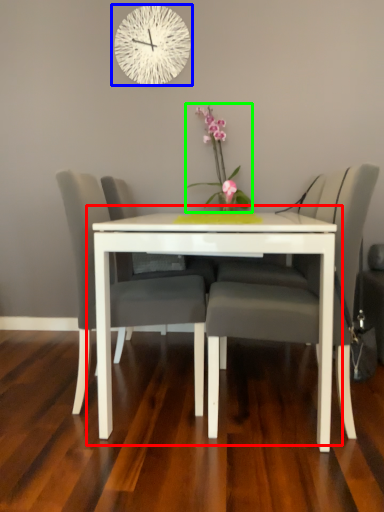
Question: Which is farther away from table (highlighted by a red box)? wall clock (highlighted by a blue box) or floral arrangement (highlighted by a green box)?

Choices:
 (A) wall clock
 (B) floral arrangement

Answer: (A)